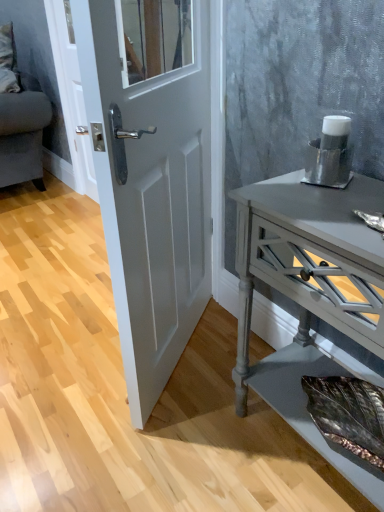
Question: Looking at the image, does velvet grey couch at upper left seem bigger or smaller compared to silver metallic cup at right?

Choices:
 (A) small
 (B) big

Answer: (B)

Question: Would you say velvet grey couch at upper left is inside or outside silver metallic cup at right?

Choices:
 (A) outside
 (B) inside

Answer: (A)

Question: Considering the real-world distances, which object is closest to the silver metallic cup at right?

Choices:
 (A) white glossy door at center
 (B) velvet grey couch at upper left
 (C) matte gray wooden nightstand at right

Answer: (C)

Question: Based on their relative distances, which object is nearer to the silver metallic cup at right?

Choices:
 (A) white glossy door at center
 (B) velvet grey couch at upper left
 (C) matte gray wooden nightstand at right

Answer: (C)